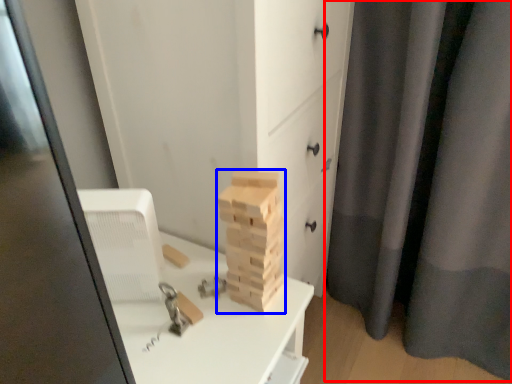
Question: Among these objects, which one is farthest to the camera, curtain (highlighted by a red box) or drawer (highlighted by a blue box)?

Choices:
 (A) curtain
 (B) drawer

Answer: (A)